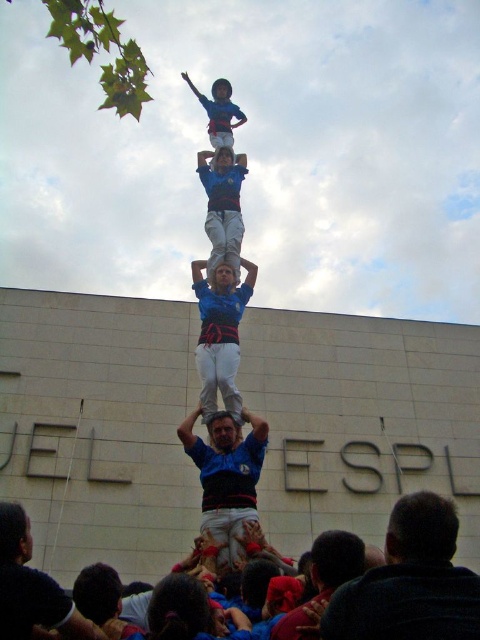
Which is in front, point (433, 593) or point (222, 122)?

Point (433, 593) is in front.

Is dark brown hair at lower right above blue fabric shirt at upper center?

Answer: Actually, dark brown hair at lower right is below blue fabric shirt at upper center.

Is point (386, 540) closer to viewer compared to point (227, 147)?

Yes.

Locate an element on the screen. The width and height of the screenshot is (480, 640). dark brown hair at lower right is located at coordinates (410, 580).

Between blue fabric man at center and dark blue shirt at center, which one has more height?

Standing taller between the two is blue fabric man at center.

Between blue fabric man at center and dark blue shirt at center, which one has less height?

dark blue shirt at center is shorter.

Does point (213, 444) come closer to viewer compared to point (2, 636)?

That is False.

At what (x,y) coordinates should I click in order to perform the action: click on blue fabric man at center. Please return your answer as a coordinate pair (x, y). The height and width of the screenshot is (640, 480). Looking at the image, I should click on tap(227, 477).

In the scene shown: Measure the distance between blue fabric shirt at center and camera.

blue fabric shirt at center and camera are 59.06 meters apart from each other.

Does point (213, 269) come in front of point (244, 163)?

Yes, it is.

The image size is (480, 640). I want to click on blue fabric shirt at center, so click(x=223, y=208).